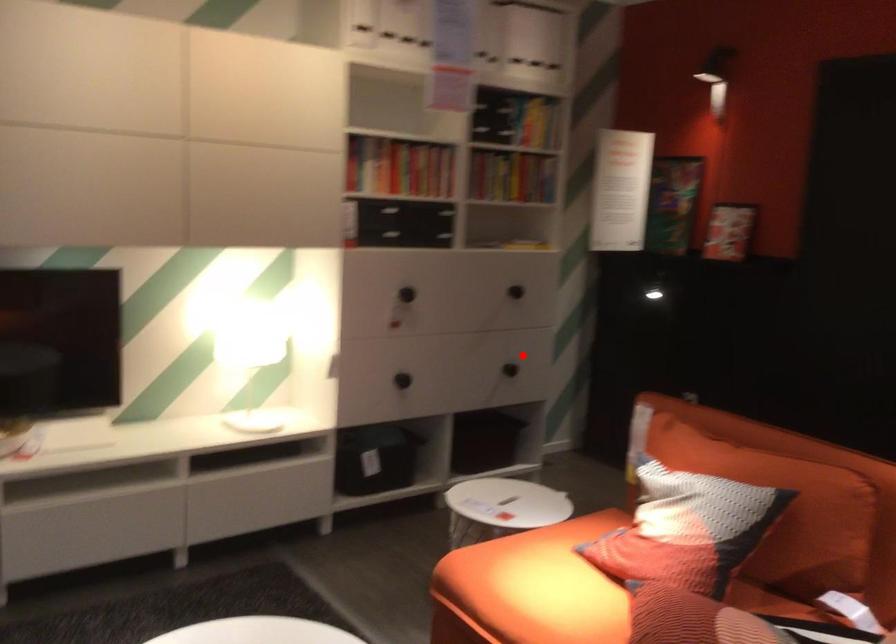
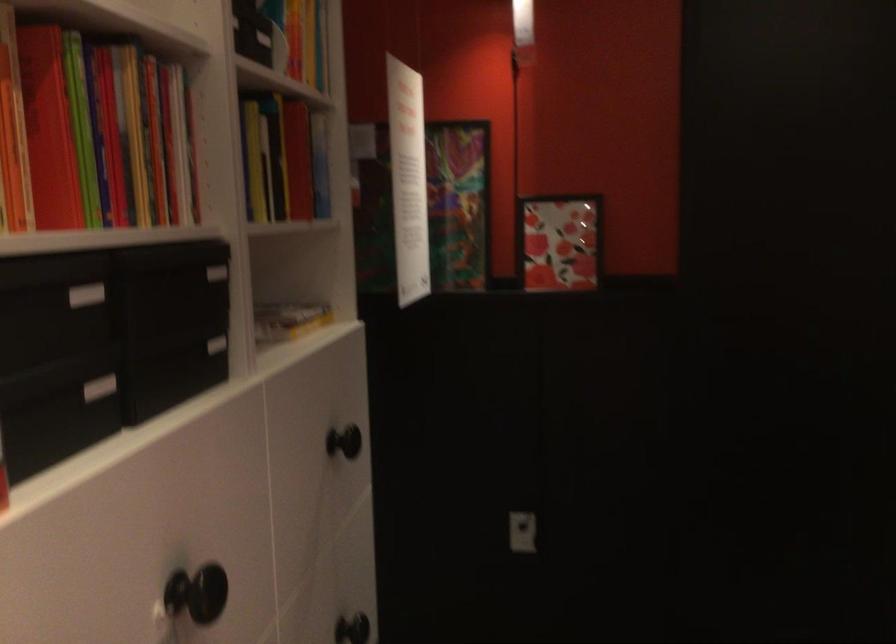
Question: I am providing you with two images of the same scene from different viewpoints. A red point is shown in image1. For the corresponding object point in image2, is it positioned nearer or farther from the camera?

Choices:
 (A) Nearer
 (B) Farther

Answer: (A)